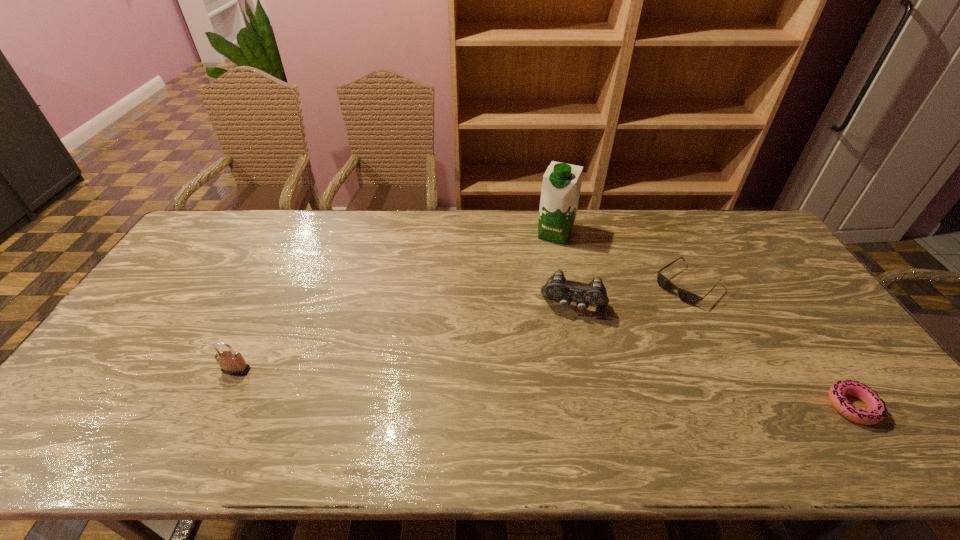
Locate an element on the screen. object that is at the near edge is located at coordinates (876, 412).

This screenshot has height=540, width=960. In order to click on object present at the right edge in this screenshot , I will do `click(876, 412)`.

Identify the location of object that is at the near right corner. The width and height of the screenshot is (960, 540). (876, 412).

Where is `free space at the far edge`? The image size is (960, 540). free space at the far edge is located at coordinates (642, 218).

In the image, there is a desktop. Identify the location of vacant area at the near edge. The image size is (960, 540). (574, 393).

The width and height of the screenshot is (960, 540). Identify the location of vacant space at the left edge. (156, 363).

I want to click on vacant space at the far right corner of the desktop, so click(704, 211).

Where is `vacant area between the doughnut and the control`? The width and height of the screenshot is (960, 540). vacant area between the doughnut and the control is located at coordinates (713, 356).

Locate an element on the screen. This screenshot has height=540, width=960. vacant area that lies between the rightmost object and the fourth farthest object is located at coordinates (544, 388).

Where is `vacant area that lies between the control and the rightmost object`? The image size is (960, 540). vacant area that lies between the control and the rightmost object is located at coordinates (713, 356).